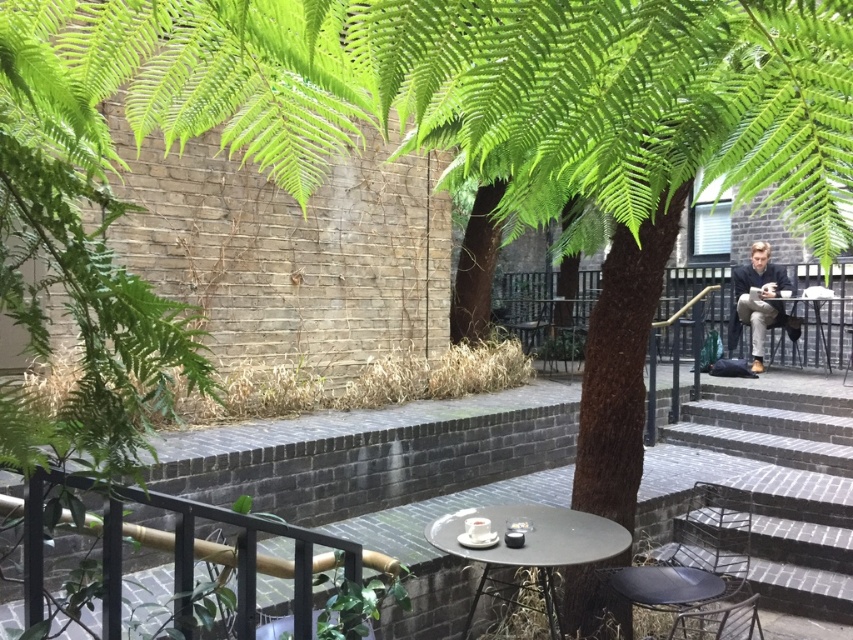
You are a customer at the outdoor seating area and want to walk from the dark gray stone stairs at center to the metallic silver table at right. Which direction should you move relative to the table?

The dark gray stone stairs at center is positioned on the left side of the metallic silver table at right, so you should move to the right relative to the table to reach it.

You are standing in the outdoor seating area and want to sit down. There is a round metal table with a glass top and a black metal chair with a cushioned seat. Where is the point at coordinates (693, 556) located?

The point at coordinates (693, 556) is located on the metallic black chair at lower right.